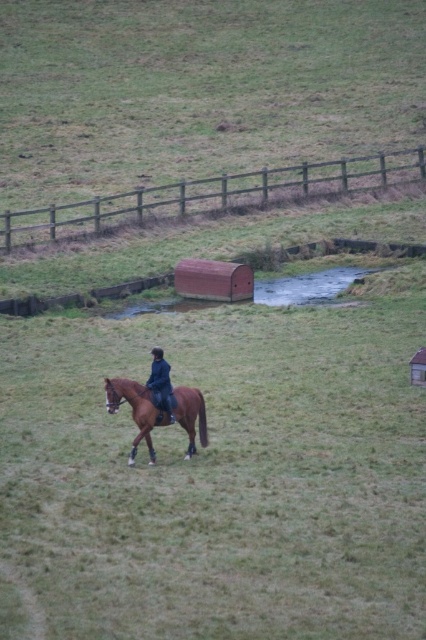
Between brown wooden fence at upper center and brown glossy horse at lower center, which one appears on the right side from the viewer's perspective?

From the viewer's perspective, brown wooden fence at upper center appears more on the right side.

Is brown wooden fence at upper center smaller than brown glossy horse at lower center?

No, brown wooden fence at upper center is not smaller than brown glossy horse at lower center.

What do you see at coordinates (210, 195) in the screenshot? This screenshot has width=426, height=640. I see `brown wooden fence at upper center` at bounding box center [210, 195].

You are a GUI agent. You are given a task and a screenshot of the screen. Output one action in this format:
    pyautogui.click(x=<x>, y=<y>)
    Task: Click on the brown wooden fence at upper center
    Image resolution: width=426 pixels, height=640 pixels.
    Given the screenshot: What is the action you would take?
    pyautogui.click(x=210, y=195)

Can you confirm if green grassy field at center is smaller than dark blue leather jacket at center?

Incorrect, green grassy field at center is not smaller in size than dark blue leather jacket at center.

Who is lower down, green grassy field at center or dark blue leather jacket at center?

Positioned lower is dark blue leather jacket at center.

Find the location of a particular element. green grassy field at center is located at coordinates (198, 88).

The height and width of the screenshot is (640, 426). I want to click on green grassy field at center, so [198, 88].

Does brown wooden fence at upper center appear under dark blue leather jacket at center?

Actually, brown wooden fence at upper center is above dark blue leather jacket at center.

Does brown wooden fence at upper center have a smaller size compared to dark blue leather jacket at center?

No.

Between point (195, 188) and point (170, 404), which one is positioned behind?

Positioned behind is point (195, 188).

At what (x,y) coordinates should I click in order to perform the action: click on brown wooden fence at upper center. Please return your answer as a coordinate pair (x, y). Looking at the image, I should click on (210, 195).